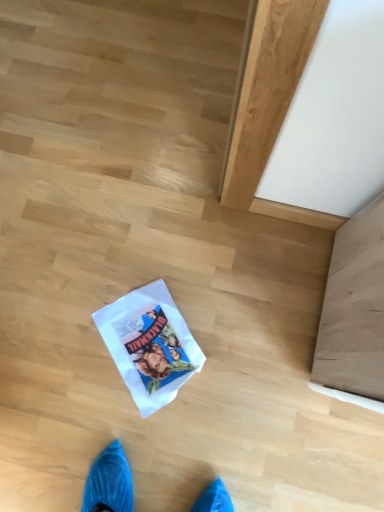
At what (x,y) coordinates should I click in order to perform the action: click on vacant space situated on the left part of white paper comic book at center. Please return your answer as a coordinate pair (x, y). This screenshot has width=384, height=512. Looking at the image, I should click on (70, 350).